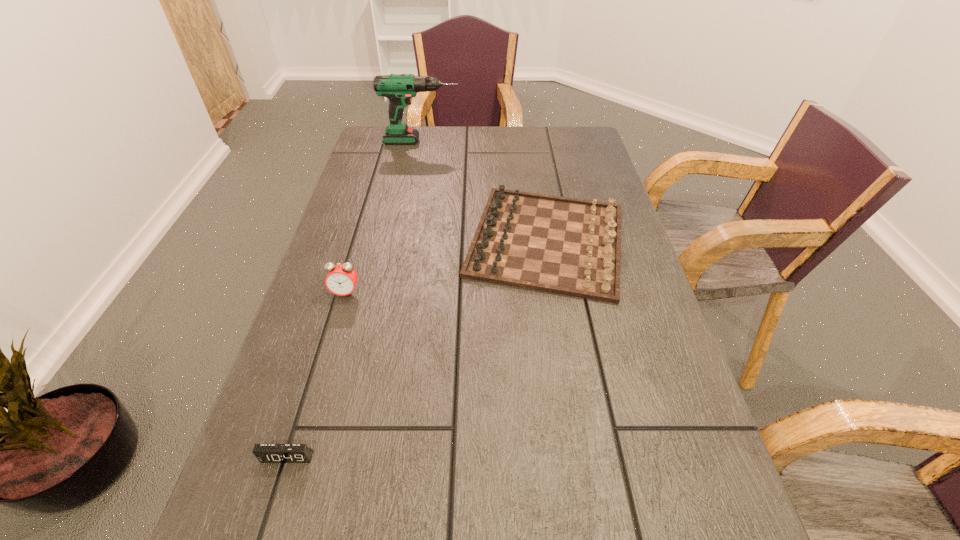
Locate an element on the screen. object that is the closest to the drill is located at coordinates (567, 246).

The height and width of the screenshot is (540, 960). Identify the location of vacant region that satisfies the following two spatial constraints: 1. on the handle side of the tallest object; 2. on the front-facing side of the nearest object. (362, 457).

The width and height of the screenshot is (960, 540). I want to click on vacant region that satisfies the following two spatial constraints: 1. on the handle side of the tallest object; 2. on the front-facing side of the taller alarm clock, so (x=393, y=293).

This screenshot has height=540, width=960. I want to click on vacant area that satisfies the following two spatial constraints: 1. on the handle side of the drill; 2. on the front-facing side of the nearest object, so click(362, 457).

Identify the location of free region that satisfies the following two spatial constraints: 1. on the handle side of the farthest object; 2. on the front-facing side of the farther alarm clock. (393, 293).

Identify the location of free spot that satisfies the following two spatial constraints: 1. on the handle side of the drill; 2. on the front-facing side of the nearest object. (362, 457).